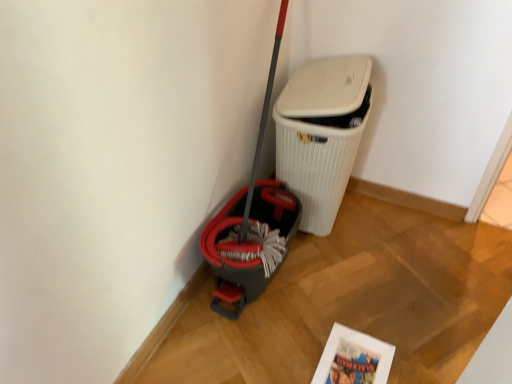
Question: Is matte white comic book at lower center wider or thinner than white textured waste bin at center?

Choices:
 (A) thin
 (B) wide

Answer: (A)

Question: In the image, is matte white comic book at lower center on the left side or the right side of white textured waste bin at center?

Choices:
 (A) right
 (B) left

Answer: (A)

Question: From the image's perspective, is matte white comic book at lower center positioned above or below white textured waste bin at center?

Choices:
 (A) above
 (B) below

Answer: (B)

Question: Considering their positions, is white textured waste bin at center located in front of or behind matte white comic book at lower center?

Choices:
 (A) behind
 (B) front

Answer: (A)

Question: Based on their sizes in the image, would you say white textured waste bin at center is bigger or smaller than matte white comic book at lower center?

Choices:
 (A) small
 (B) big

Answer: (B)

Question: From the image's perspective, is white textured waste bin at center above or below matte white comic book at lower center?

Choices:
 (A) above
 (B) below

Answer: (A)

Question: Considering the positions of white textured waste bin at center and matte white comic book at lower center in the image, is white textured waste bin at center wider or thinner than matte white comic book at lower center?

Choices:
 (A) thin
 (B) wide

Answer: (B)